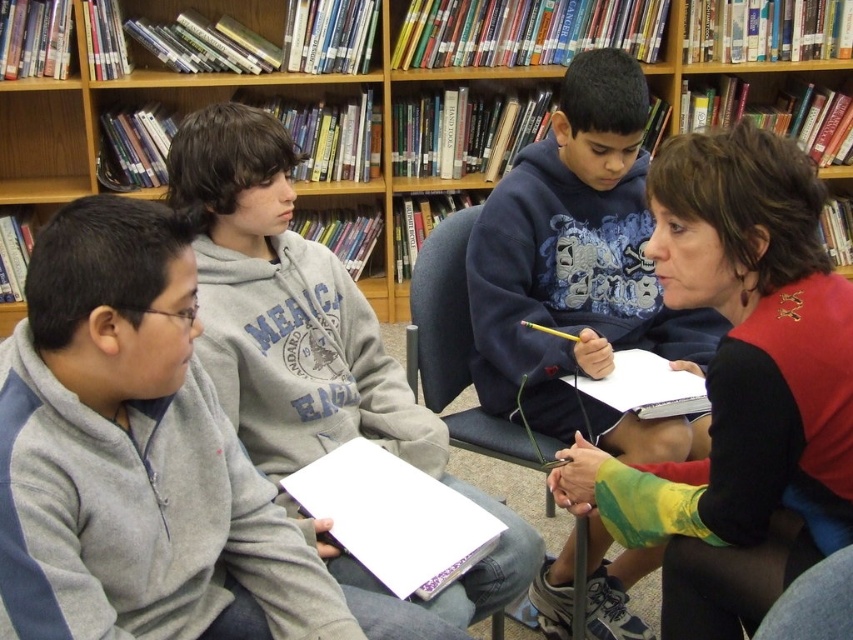
You are a tailor who needs to determine which hoodie requires more fabric to make between the gray fleece hoodie at left and the blue hoodie at center. Based on the image, which one would need more fabric?

The blue hoodie at center requires more fabric than the gray fleece hoodie at left because it is larger in size.

You are a librarian who needs to place a large sculpture that is 2 meters tall. You see the wooden bookcase at upper center and the blue fabric chair at lower right. Which object can the sculpture be placed next to without blocking the view of the other object?

The wooden bookcase at upper center is bigger than the blue fabric chair at lower right, so placing the sculpture next to the wooden bookcase at upper center would be more appropriate as it can accommodate the sculpture without obstructing the view of the blue fabric chair at lower right.